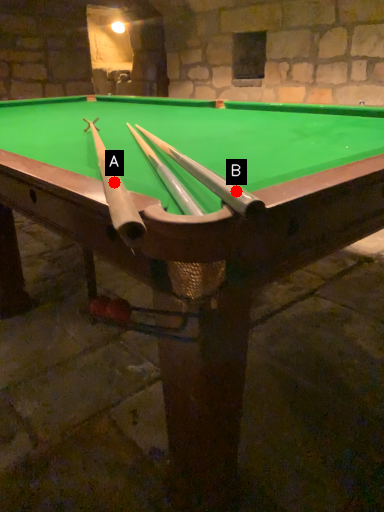
Question: Two points are circled on the image, labeled by A and B beside each circle. Which point appears farthest from the camera in this image?

Choices:
 (A) A is further
 (B) B is further

Answer: (A)